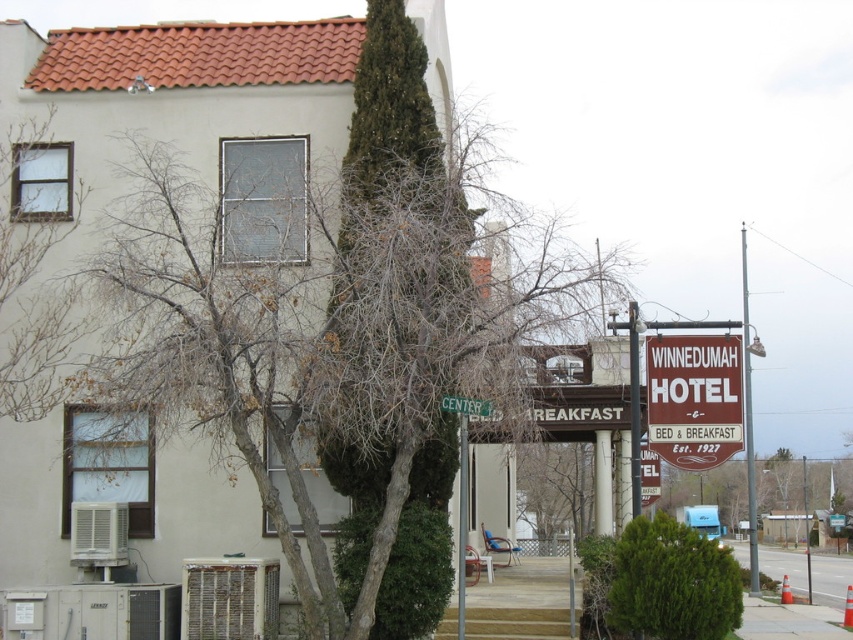
You are a pedestrian standing on the sidewalk in front of the building. You see the bare branches at left and the white plastic street sign at center. Which object is closer to the sky?

The bare branches at left are closer to the sky because they are positioned over the white plastic street sign at center.

You are a delivery person who needs to place a package between the green textured bush at center and the white plastic street sign at center. The package requires 3 meters of space to be placed safely. Is there enough space between them?

The green textured bush at center is 2.98 meters from the white plastic street sign at center. Since the required space is 3 meters, there is not enough space to place the package safely between them.

You are standing at the entrance of the building and want to reach both the brown wooden sign at center right and the white plastic street sign at center. Which sign is closer to you?

The white plastic street sign at center is closer because the brown wooden sign at center right is 6.59 meters away from it, meaning the white plastic street sign at center is nearer to your current position.